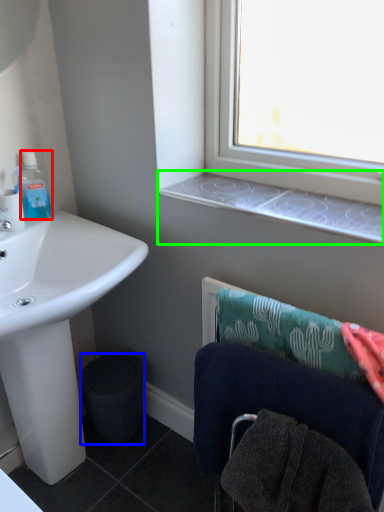
Question: Which object is the farthest from bottle (highlighted by a red box)? Choose among these: trash bin/can (highlighted by a blue box) or window sill (highlighted by a green box).

Choices:
 (A) trash bin/can
 (B) window sill

Answer: (A)